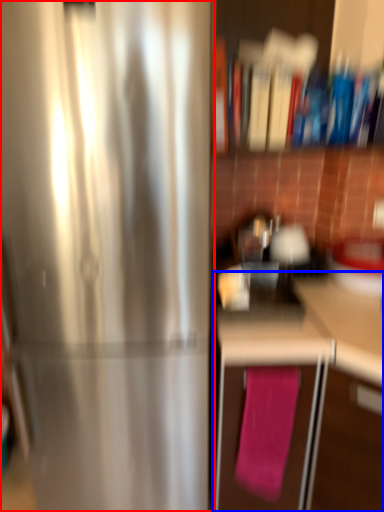
Question: Which object is closer to the camera taking this photo, refrigerator (highlighted by a red box) or cabinetry (highlighted by a blue box)?

Choices:
 (A) refrigerator
 (B) cabinetry

Answer: (B)